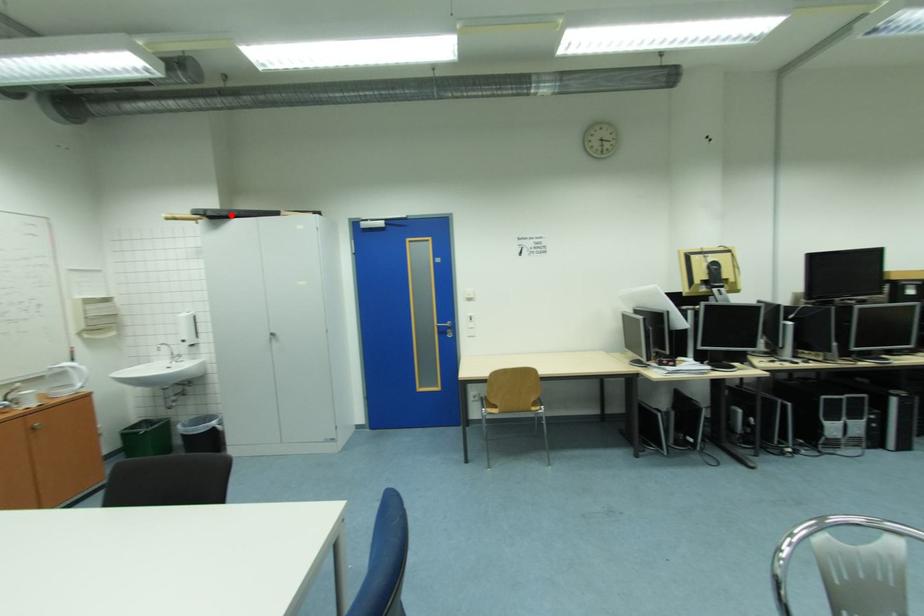
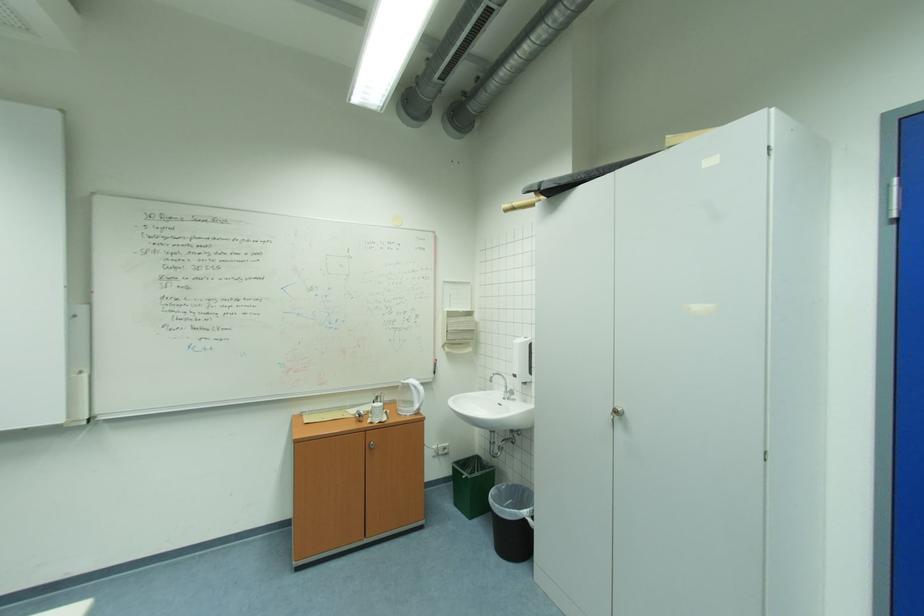
The point at the highlighted location is marked in the first image. Where is the corresponding point in the second image?

(569, 182)